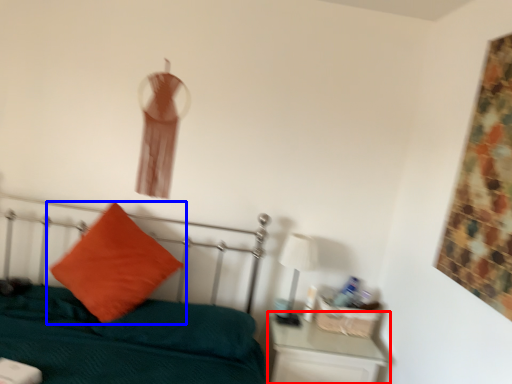
Question: Which object appears closest to the camera in this image, nightstand (highlighted by a red box) or pillow (highlighted by a blue box)?

Choices:
 (A) nightstand
 (B) pillow

Answer: (B)